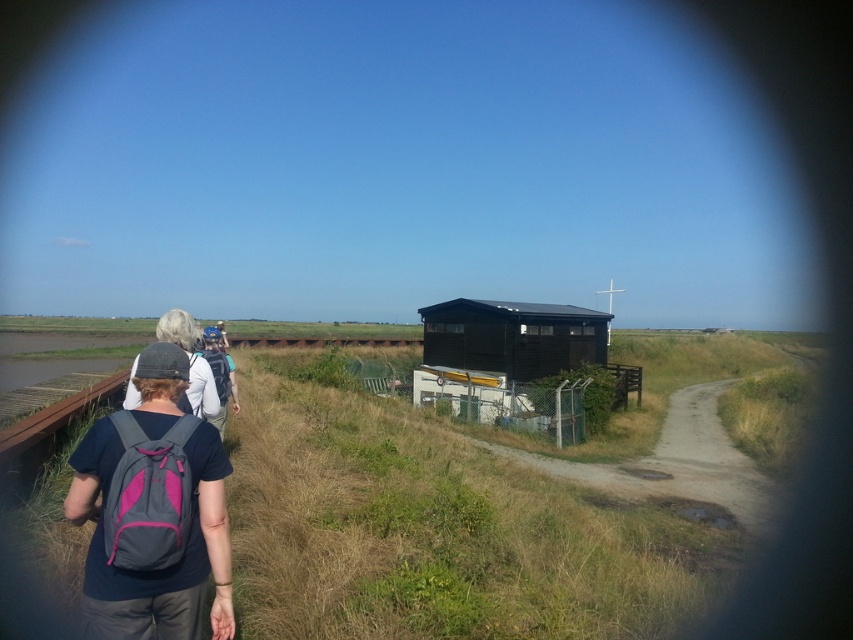
Is brown wooden hut at center closer to the viewer compared to matte gray backpack at center?

No, brown wooden hut at center is behind matte gray backpack at center.

Which is more to the left, brown wooden hut at center or matte gray backpack at center?

matte gray backpack at center is more to the left.

Who is more forward, (527, 348) or (225, 396)?

Positioned in front is point (225, 396).

Identify the location of brown wooden hut at center. The width and height of the screenshot is (853, 640). coord(514,337).

Which is more to the left, gray fabric backpack at lower left or brown wooden hut at center?

gray fabric backpack at lower left is more to the left.

The width and height of the screenshot is (853, 640). I want to click on gray fabric backpack at lower left, so click(170, 564).

Is point (169, 404) positioned behind point (524, 317)?

No, it is in front of (524, 317).

Where is `gray fabric backpack at lower left`? This screenshot has height=640, width=853. gray fabric backpack at lower left is located at coordinates (170, 564).

From the picture: Between gray fabric hat at upper left and matte gray backpack at center, which one is positioned higher?

gray fabric hat at upper left is above.

Between gray fabric hat at upper left and matte gray backpack at center, which one is positioned lower?

matte gray backpack at center is below.

Does point (131, 396) come behind point (224, 404)?

No, it is in front of (224, 404).

The width and height of the screenshot is (853, 640). What are the coordinates of `gray fabric hat at upper left` in the screenshot? It's located at (190, 362).